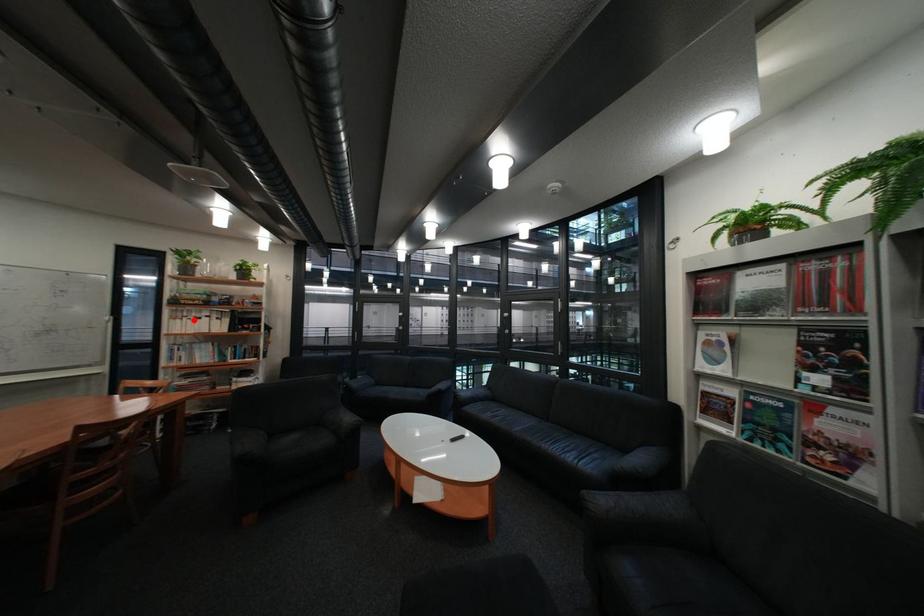
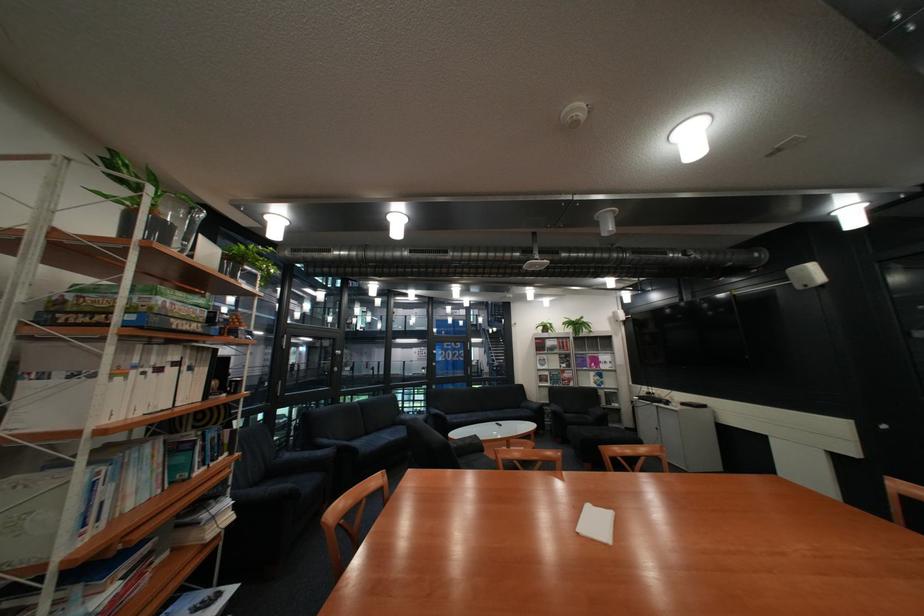
The point at the highlighted location is marked in the first image. Where is the corresponding point in the second image?

(134, 379)